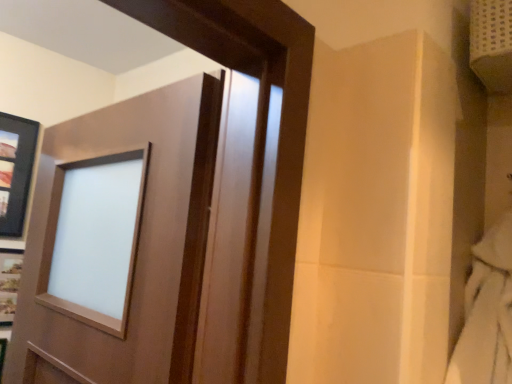
Question: Considering the relative sizes of matte black picture frame at upper left and satin wood door at center in the image provided, is matte black picture frame at upper left bigger than satin wood door at center?

Choices:
 (A) yes
 (B) no

Answer: (B)

Question: From a real-world perspective, is matte black picture frame at upper left on top of satin wood door at center?

Choices:
 (A) no
 (B) yes

Answer: (B)

Question: Is matte black picture frame at upper left taller than satin wood door at center?

Choices:
 (A) no
 (B) yes

Answer: (A)

Question: Does matte black picture frame at upper left come in front of satin wood door at center?

Choices:
 (A) yes
 (B) no

Answer: (B)

Question: Is matte black picture frame at upper left with satin wood door at center?

Choices:
 (A) yes
 (B) no

Answer: (B)

Question: Is matte black picture frame at upper left oriented away from satin wood door at center?

Choices:
 (A) yes
 (B) no

Answer: (B)

Question: Can you confirm if satin wood door at center is smaller than matte black picture frame at upper left?

Choices:
 (A) yes
 (B) no

Answer: (B)

Question: From the image's perspective, would you say satin wood door at center is shown under matte black picture frame at upper left?

Choices:
 (A) yes
 (B) no

Answer: (A)

Question: Does satin wood door at center come behind matte black picture frame at upper left?

Choices:
 (A) yes
 (B) no

Answer: (B)

Question: Can you confirm if satin wood door at center is wider than matte black picture frame at upper left?

Choices:
 (A) yes
 (B) no

Answer: (A)

Question: Is matte black picture frame at upper left at the back of satin wood door at center?

Choices:
 (A) no
 (B) yes

Answer: (A)

Question: Considering the relative positions of satin wood door at center and matte black picture frame at upper left in the image provided, is satin wood door at center to the left of matte black picture frame at upper left from the viewer's perspective?

Choices:
 (A) no
 (B) yes

Answer: (A)

Question: From the image's perspective, is satin wood door at center above or below matte black picture frame at upper left?

Choices:
 (A) above
 (B) below

Answer: (B)